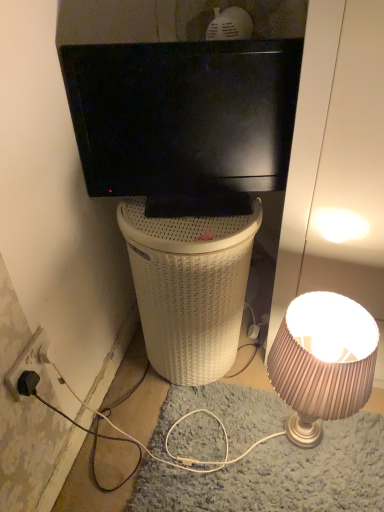
Question: Should I look upward or downward to see shiny beige lampshade at right?

Choices:
 (A) down
 (B) up

Answer: (A)

Question: Does shiny beige lampshade at right touch black glossy television at upper center?

Choices:
 (A) no
 (B) yes

Answer: (A)

Question: Does shiny beige lampshade at right appear on the left side of black glossy television at upper center?

Choices:
 (A) no
 (B) yes

Answer: (A)

Question: Is shiny beige lampshade at right not close to black glossy television at upper center?

Choices:
 (A) yes
 (B) no

Answer: (B)

Question: From a real-world perspective, does shiny beige lampshade at right sit lower than black glossy television at upper center?

Choices:
 (A) no
 (B) yes

Answer: (B)

Question: Does shiny beige lampshade at right have a greater width compared to black glossy television at upper center?

Choices:
 (A) yes
 (B) no

Answer: (A)

Question: Is shiny beige lampshade at right closer to camera compared to black glossy television at upper center?

Choices:
 (A) yes
 (B) no

Answer: (A)

Question: Can you confirm if black plastic power outlet at lower left is shorter than white wicker trash bin/can at center?

Choices:
 (A) no
 (B) yes

Answer: (B)

Question: From a real-world perspective, is black plastic power outlet at lower left located beneath white wicker trash bin/can at center?

Choices:
 (A) no
 (B) yes

Answer: (A)

Question: Does black plastic power outlet at lower left have a smaller size compared to white wicker trash bin/can at center?

Choices:
 (A) yes
 (B) no

Answer: (A)

Question: Considering the relative sizes of black plastic power outlet at lower left and white wicker trash bin/can at center in the image provided, is black plastic power outlet at lower left taller than white wicker trash bin/can at center?

Choices:
 (A) yes
 (B) no

Answer: (B)

Question: Can you confirm if black plastic power outlet at lower left is wider than white wicker trash bin/can at center?

Choices:
 (A) yes
 (B) no

Answer: (B)

Question: From a real-world perspective, is black plastic power outlet at lower left physically above white wicker trash bin/can at center?

Choices:
 (A) no
 (B) yes

Answer: (B)

Question: Is black plastic power outlet at lower left located within black glossy television at upper center?

Choices:
 (A) no
 (B) yes

Answer: (A)